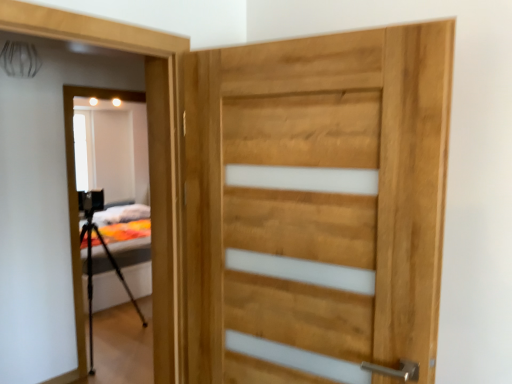
What do you see at coordinates (92, 275) in the screenshot? I see `black matte tripod at left` at bounding box center [92, 275].

Identify the location of black matte tripod at left. (92, 275).

What do you see at coordinates (316, 206) in the screenshot? I see `natural wood door at center` at bounding box center [316, 206].

Image resolution: width=512 pixels, height=384 pixels. What are the coordinates of `natural wood door at center` in the screenshot? It's located at (316, 206).

You are a GUI agent. You are given a task and a screenshot of the screen. Output one action in this format:
    pyautogui.click(x=<x>, y=<y>)
    Task: Click on the black matte tripod at left
    The image size is (512, 384).
    Given the screenshot: What is the action you would take?
    pyautogui.click(x=92, y=275)

Is black matte tripod at left to the left or to the right of natural wood door at center in the image?

In the image, black matte tripod at left appears on the left side of natural wood door at center.

Considering the relative positions of black matte tripod at left and natural wood door at center in the image provided, is black matte tripod at left behind natural wood door at center?

Yes, the depth of black matte tripod at left is greater than that of natural wood door at center.

Which is behind, point (91, 369) or point (191, 82)?

Positioned behind is point (91, 369).

From the image's perspective, is black matte tripod at left above or below natural wood door at center?

Clearly, from the image's perspective, black matte tripod at left is below natural wood door at center.

From a real-world perspective, is black matte tripod at left under natural wood door at center?

Yes, from a real-world perspective, black matte tripod at left is under natural wood door at center.

Considering the sizes of objects black matte tripod at left and natural wood door at center in the image provided, who is wider, black matte tripod at left or natural wood door at center?

black matte tripod at left is wider.

Who is shorter, black matte tripod at left or natural wood door at center?

With less height is natural wood door at center.

Is black matte tripod at left smaller than natural wood door at center?

Incorrect, black matte tripod at left is not smaller in size than natural wood door at center.

Is natural wood door at center a part of black matte tripod at left?

No, natural wood door at center is located outside of black matte tripod at left.

Would you say black matte tripod at left is a long distance from natural wood door at center?

black matte tripod at left is positioned a significant distance from natural wood door at center.

From the picture: Does black matte tripod at left turn towards natural wood door at center?

No, black matte tripod at left is not turned towards natural wood door at center.

What's the angular difference between black matte tripod at left and natural wood door at center's facing directions?

The angle between the facing direction of black matte tripod at left and the facing direction of natural wood door at center is 135 degrees.

You are a GUI agent. You are given a task and a screenshot of the screen. Output one action in this format:
    pyautogui.click(x=<x>, y=<y>)
    Task: Click on the tripod below the natural wood door at center (from a real-world perspective)
    The width and height of the screenshot is (512, 384).
    Given the screenshot: What is the action you would take?
    tap(92, 275)

Visually, is natural wood door at center positioned to the left or to the right of black matte tripod at left?

Based on their positions, natural wood door at center is located to the right of black matte tripod at left.

From the picture: Does natural wood door at center come behind black matte tripod at left?

No, it is in front of black matte tripod at left.

Is point (389, 244) closer or farther from the camera than point (90, 298)?

Point (389, 244) is positioned closer to the camera compared to point (90, 298).

From the image's perspective, which is above, natural wood door at center or black matte tripod at left?

natural wood door at center appears higher in the image.

From a real-world perspective, is natural wood door at center above or below black matte tripod at left?

natural wood door at center is situated higher than black matte tripod at left in the real world.

In terms of width, does natural wood door at center look wider or thinner when compared to black matte tripod at left?

Clearly, natural wood door at center has less width compared to black matte tripod at left.

Can you confirm if natural wood door at center is shorter than black matte tripod at left?

Yes, natural wood door at center is shorter than black matte tripod at left.

Between natural wood door at center and black matte tripod at left, which one has larger size?

black matte tripod at left.

Do you think natural wood door at center is within black matte tripod at left, or outside of it?

The correct answer is: outside.

Is natural wood door at center not near black matte tripod at left?

natural wood door at center is far away from black matte tripod at left.

Looking at this image, is natural wood door at center facing towards black matte tripod at left?

No, natural wood door at center is not oriented towards black matte tripod at left.

The width and height of the screenshot is (512, 384). In the image, there is a black matte tripod at left. In order to click on door above it (from the image's perspective) in this screenshot , I will do `click(316, 206)`.

This screenshot has height=384, width=512. Find the location of `tripod on the left of natural wood door at center`. tripod on the left of natural wood door at center is located at coordinates (92, 275).

Find the location of a particular element. Image resolution: width=512 pixels, height=384 pixels. door in front of the black matte tripod at left is located at coordinates (316, 206).